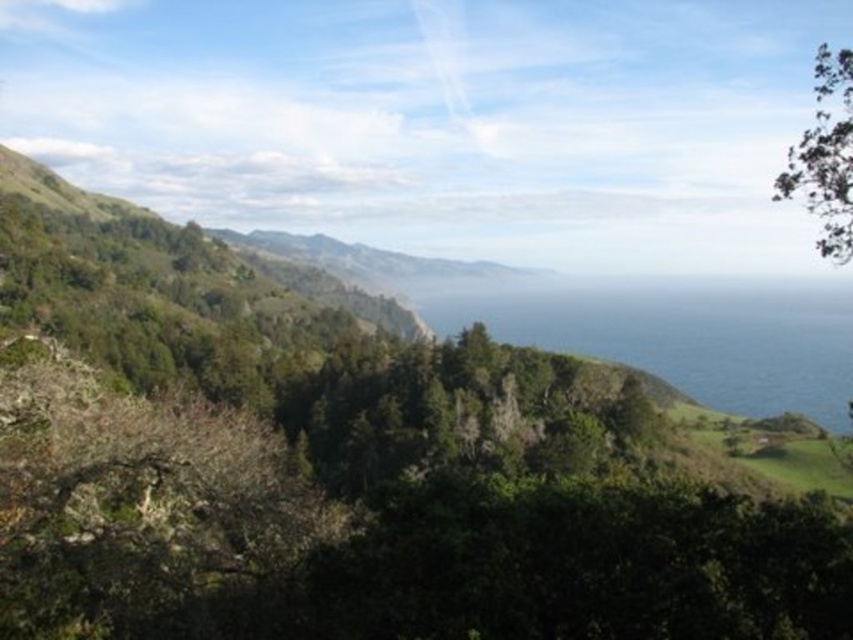
Question: Which object is farther from the camera taking this photo?

Choices:
 (A) blue liquid at center
 (B) green leafy tree at upper right

Answer: (A)

Question: Is blue liquid at center positioned before green leafy tree at upper right?

Choices:
 (A) no
 (B) yes

Answer: (A)

Question: Can you confirm if blue liquid at center is thinner than green leafy tree at upper right?

Choices:
 (A) yes
 (B) no

Answer: (B)

Question: Can you confirm if blue liquid at center is smaller than green leafy tree at upper right?

Choices:
 (A) no
 (B) yes

Answer: (A)